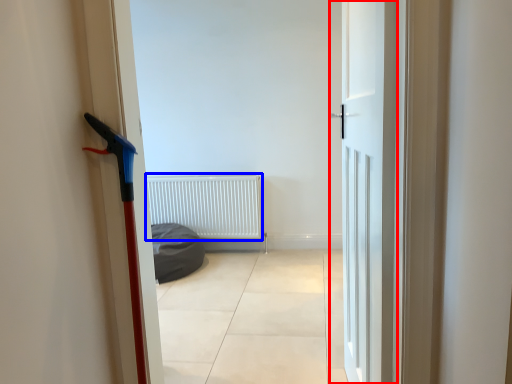
Question: Among these objects, which one is nearest to the camera, door (highlighted by a red box) or radiator (highlighted by a blue box)?

Choices:
 (A) door
 (B) radiator

Answer: (A)